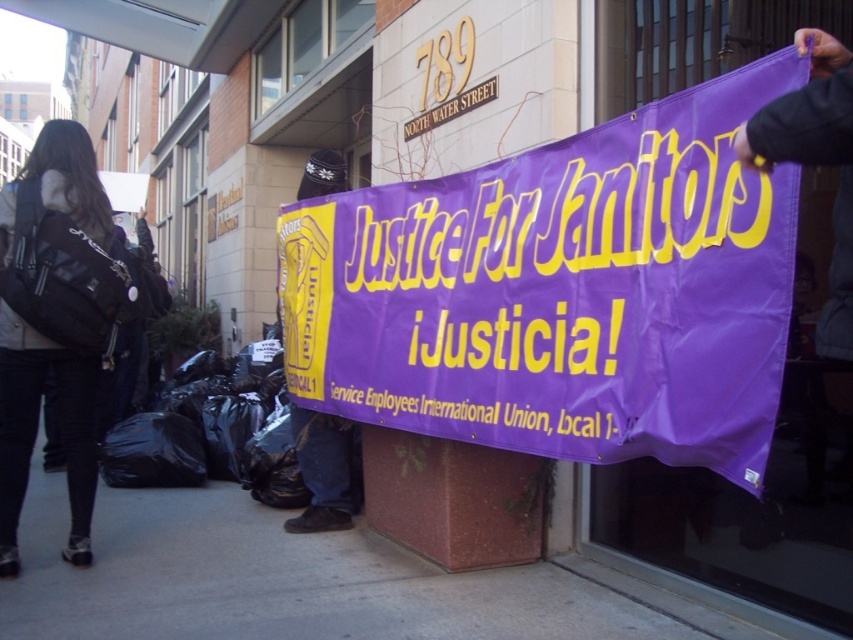
Between point (753, 296) and point (132, 556), which one is positioned in front?

Point (753, 296) is more forward.

This screenshot has width=853, height=640. Identify the location of purple fabric banner at center. (563, 291).

Can you confirm if purple fabric banner at center is positioned to the right of black fabric backpack at left?

Correct, you'll find purple fabric banner at center to the right of black fabric backpack at left.

Is purple fabric banner at center to the left of black fabric backpack at left from the viewer's perspective?

No, purple fabric banner at center is not to the left of black fabric backpack at left.

Is point (703, 403) positioned in front of point (21, 413)?

Yes, it is.

In order to click on purple fabric banner at center in this screenshot , I will do `click(563, 291)`.

Does purple fabric banner at lower center have a greater height compared to black fabric backpack at left?

No, purple fabric banner at lower center is not taller than black fabric backpack at left.

Who is higher up, purple fabric banner at lower center or black fabric backpack at left?

black fabric backpack at left is above.

Locate an element on the screen. This screenshot has width=853, height=640. purple fabric banner at lower center is located at coordinates [305, 580].